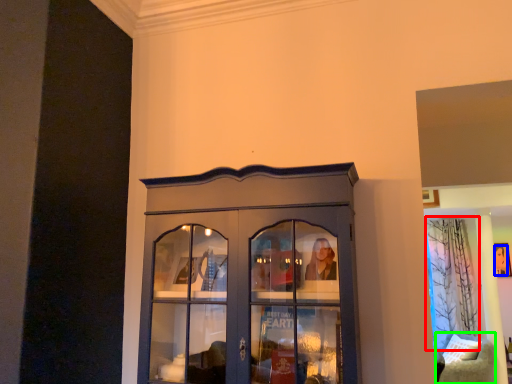
Question: Which object is positioned closest to curtain (highlighted by a red box)? Select from person (highlighted by a blue box) and furniture (highlighted by a green box).

Choices:
 (A) person
 (B) furniture

Answer: (A)